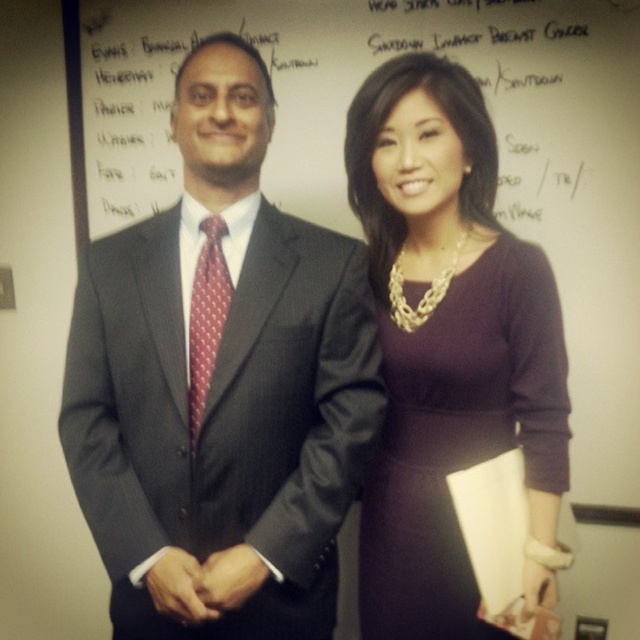
You are standing in front of the whiteboard and need to locate the dark gray suit at center. Where exactly should you look?

You should look at point 0.603 on the horizontal axis and 0.345 on the vertical axis to find the dark gray suit at center.

You are standing in front of the two people in the image. Where is the whiteboard at upper center located relative to you?

The whiteboard at upper center is located at point (342, 140) relative to you.